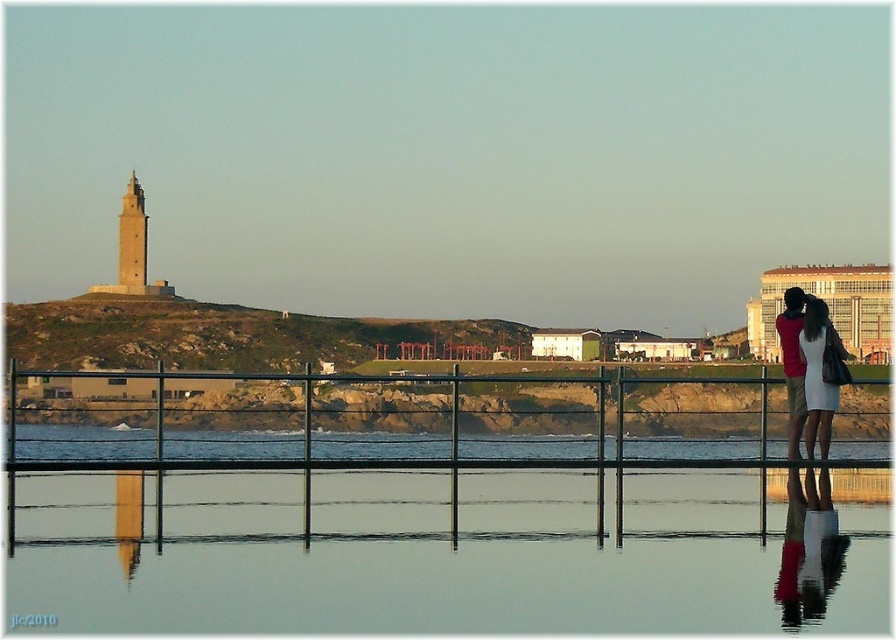
Question: Does beige stone tower at left appear under white dress at center?

Choices:
 (A) no
 (B) yes

Answer: (A)

Question: Which point is farther to the camera?

Choices:
 (A) white dress at center
 (B) beige stone tower at left

Answer: (B)

Question: Which point is closer to the camera taking this photo?

Choices:
 (A) (802, 420)
 (B) (118, 212)
 (C) (134, 182)

Answer: (A)

Question: Which of these objects is positioned closest to the white dress at center?

Choices:
 (A) metal fence at center
 (B) brown stone tower at left
 (C) beige stone tower at left

Answer: (A)

Question: Is red fabric shirt at right to the left of brown stone tower at left from the viewer's perspective?

Choices:
 (A) yes
 (B) no

Answer: (B)

Question: Can you confirm if white dress at center is positioned to the right of brown stone tower at left?

Choices:
 (A) yes
 (B) no

Answer: (A)